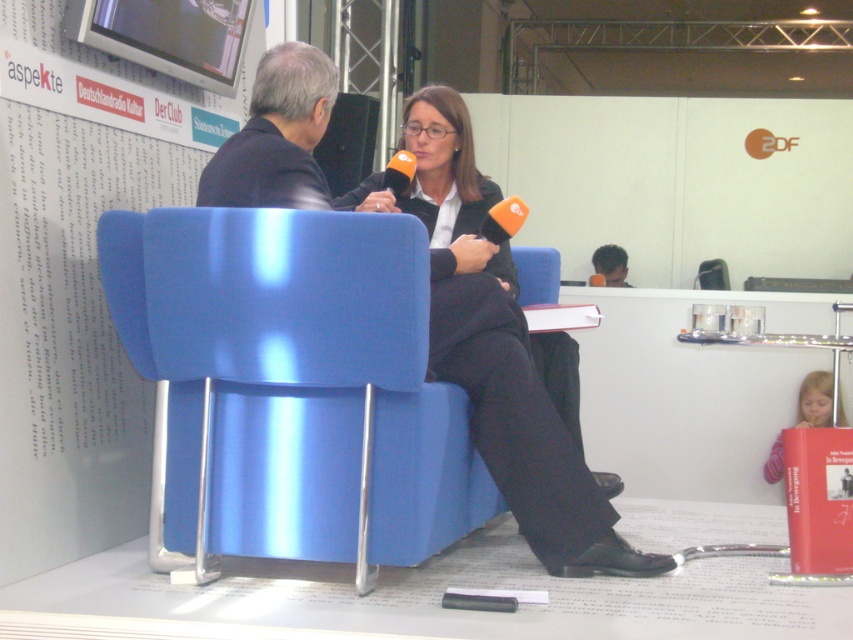
Question: Which of the following is the closest to the observer?

Choices:
 (A) (814, 378)
 (B) (457, 195)

Answer: (B)

Question: Is the position of matte black blazer at center less distant than that of matte black suit at center?

Choices:
 (A) yes
 (B) no

Answer: (A)

Question: Does matte black blazer at center have a larger size compared to matte black suit at center?

Choices:
 (A) no
 (B) yes

Answer: (B)

Question: Which point is farther to the camera?

Choices:
 (A) (805, 417)
 (B) (584, 481)

Answer: (A)

Question: Does matte black blazer at center appear on the right side of matte black suit at center?

Choices:
 (A) yes
 (B) no

Answer: (B)